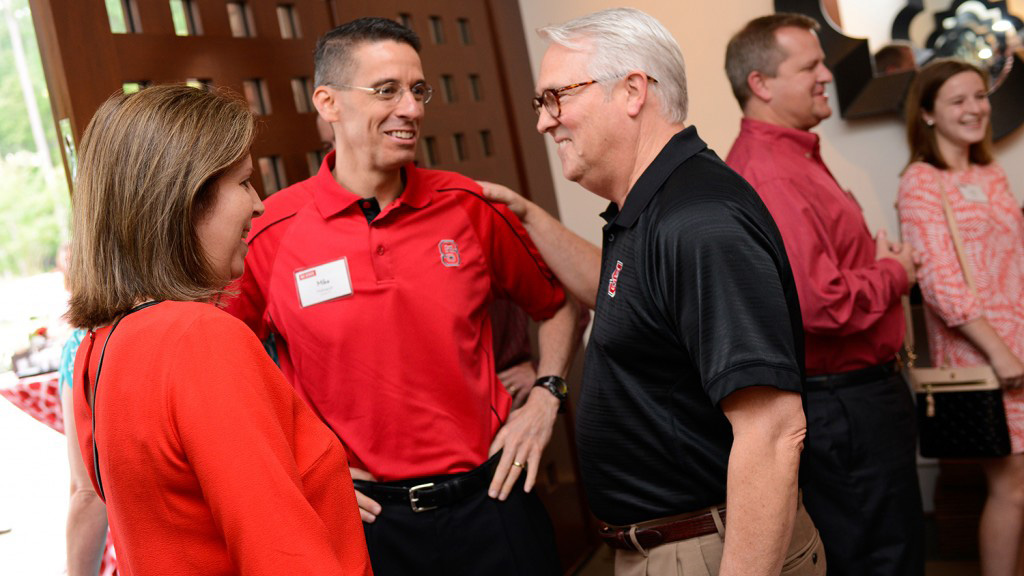
You are a GUI agent. You are given a task and a screenshot of the screen. Output one action in this format:
    pyautogui.click(x=<x>, y=<y>)
    Task: Click on the door
    This screenshot has height=576, width=1024.
    Given the screenshot: What is the action you would take?
    pyautogui.click(x=144, y=59)